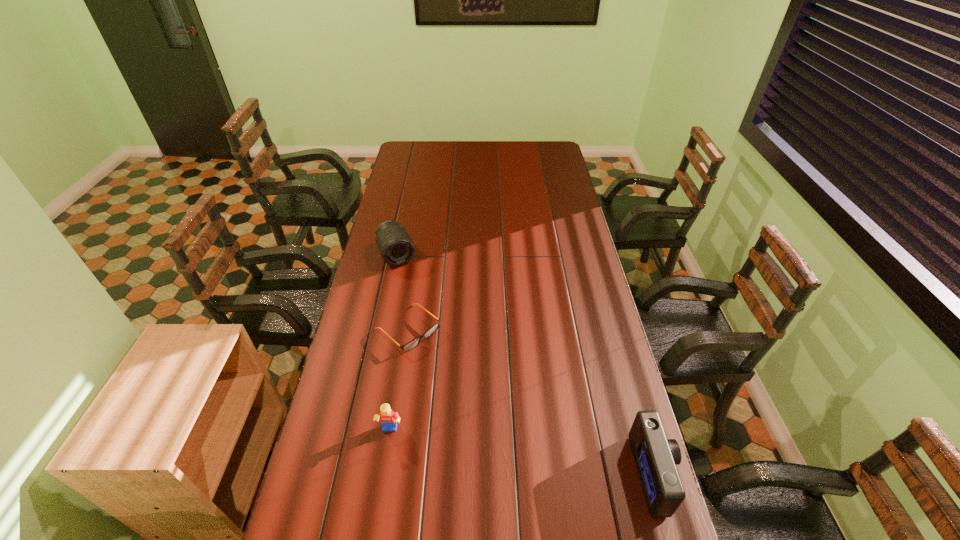
The height and width of the screenshot is (540, 960). Identify the location of free space located on the front-facing side of the third nearest object. (506, 418).

You are a GUI agent. You are given a task and a screenshot of the screen. Output one action in this format:
    pyautogui.click(x=<x>, y=<y>)
    Task: Click on the blank space located on the front-facing side of the third nearest object
    This screenshot has height=540, width=960.
    Given the screenshot: What is the action you would take?
    pyautogui.click(x=458, y=375)

Locate an element on the screen. This screenshot has width=960, height=540. object present at the near edge is located at coordinates (656, 457).

Where is `telephoto lens located at the left edge`? telephoto lens located at the left edge is located at coordinates (396, 247).

The image size is (960, 540). I want to click on spectacles located at the left edge, so click(413, 343).

Where is `object situated at the right edge`? The height and width of the screenshot is (540, 960). object situated at the right edge is located at coordinates (656, 457).

Find the location of a particular element. object situated at the near right corner is located at coordinates (656, 457).

Identify the location of free location at the far edge of the desktop. Image resolution: width=960 pixels, height=540 pixels. click(x=456, y=153).

This screenshot has width=960, height=540. I want to click on free space at the left edge of the desktop, so click(379, 276).

You are a GUI agent. You are given a task and a screenshot of the screen. Output one action in this format:
    pyautogui.click(x=<x>, y=<y>)
    Task: Click on the vacant space at the right edge of the desktop
    Image resolution: width=960 pixels, height=540 pixels.
    Given the screenshot: What is the action you would take?
    pyautogui.click(x=594, y=421)